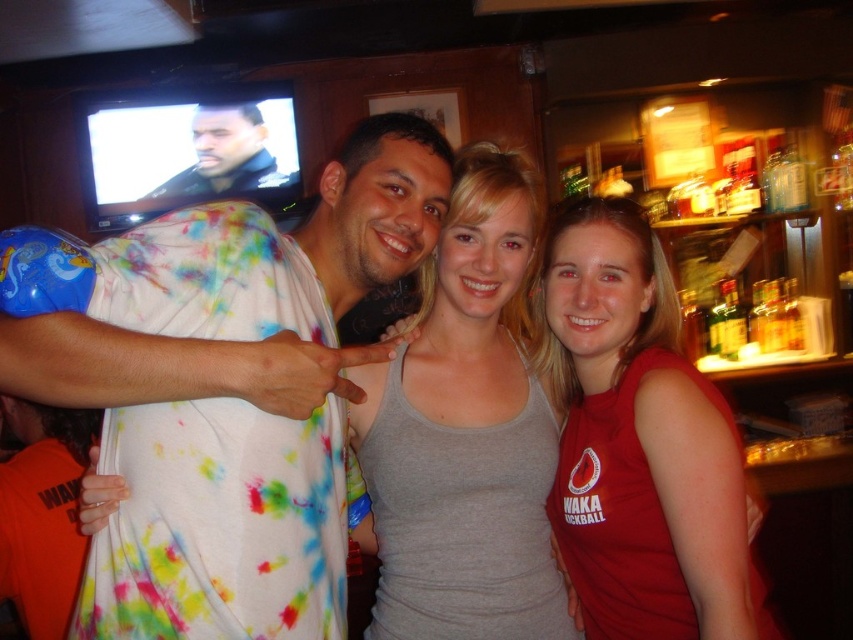
You are a photographer adjusting your camera settings to focus on the gray matte tank top at center and the dark blue leather jacket at upper left. Which object should you focus on first to ensure both are in sharp focus?

You should focus on the gray matte tank top at center first because it is closer to the viewer than the dark blue leather jacket at upper left, so focusing on the closer object first will help ensure both are in focus.